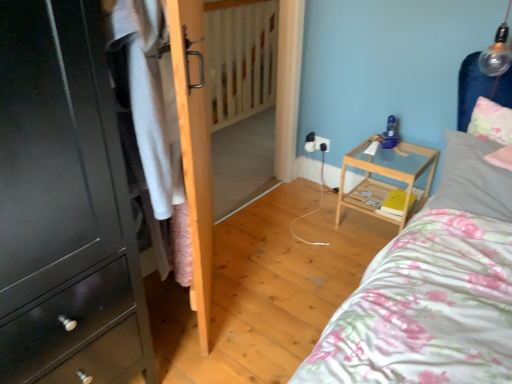
Image resolution: width=512 pixels, height=384 pixels. I want to click on vacant space to the right of wooden door at left, so click(285, 281).